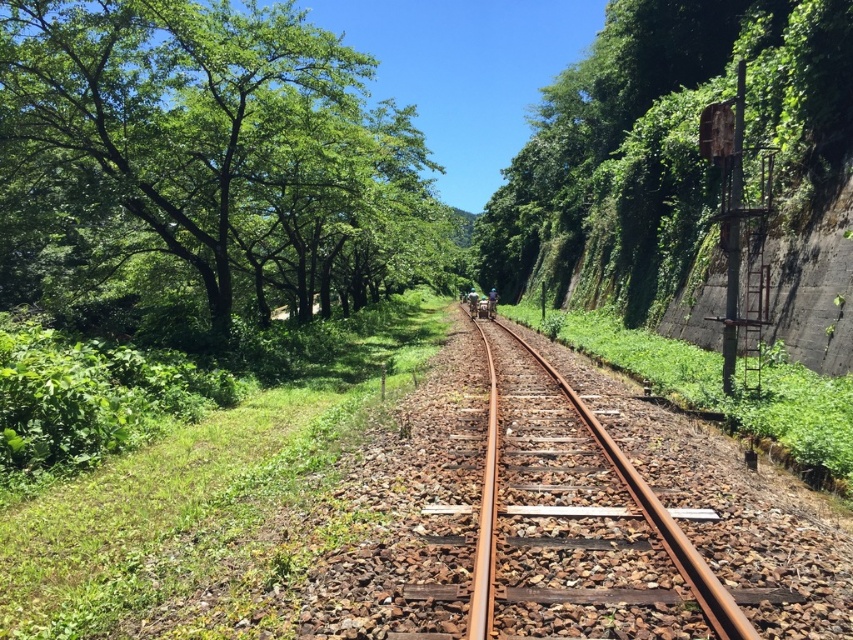
You are standing at the center of the railway tracks and want to reach the green leafy trees at upper left. In which direction should you walk to get there?

The green leafy trees at upper left are located at point coordinates indicating they are positioned to the upper left relative to your current position at the center of the tracks. To reach them, you should walk towards the upper left direction from your current position.

You are a bird looking for a nesting spot. You see the green leafy trees at upper left and the green leafy tree at right. Which tree would you choose if you prefer a smaller nesting area?

The green leafy trees at upper left has a smaller size compared to the green leafy tree at right, so you should choose the green leafy trees at upper left for a smaller nesting area.

You are a photographer planning to take a picture of the green leafy tree at right and the rusty metal train track at center. Based on their sizes in the image, which object would appear bigger in your photo?

The green leafy tree at right appears bigger in the photo because it is larger in size than the rusty metal train track at center.